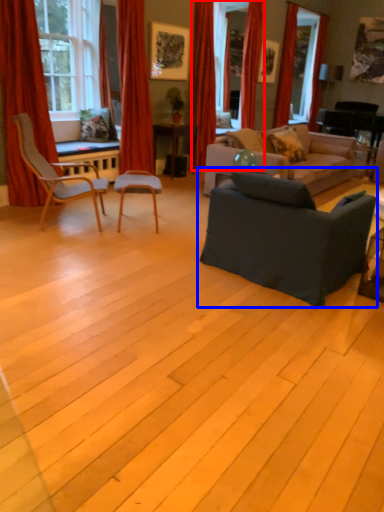
Question: Which object is further to the camera taking this photo, curtain (highlighted by a red box) or studio couch (highlighted by a blue box)?

Choices:
 (A) curtain
 (B) studio couch

Answer: (A)